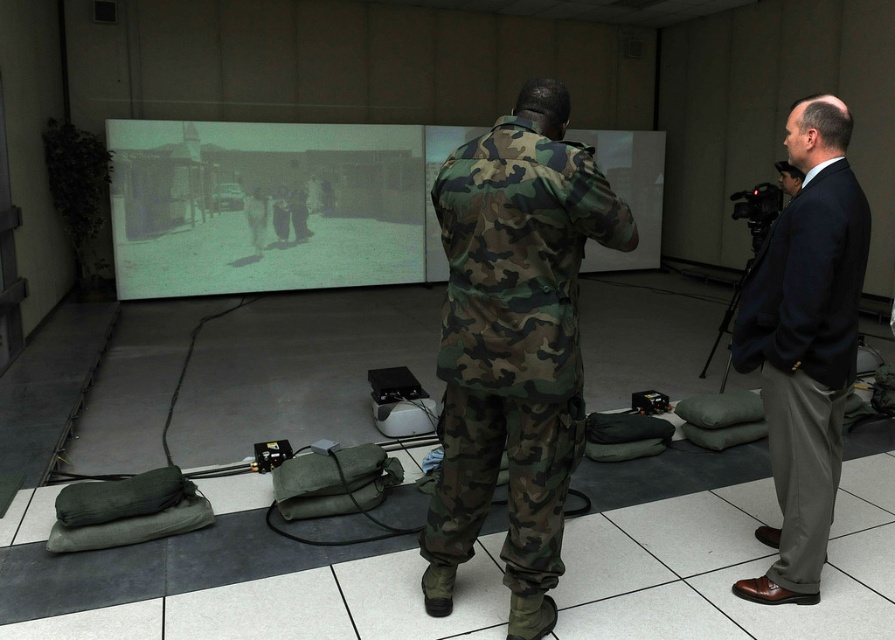
You are a safety officer inspecting the training room. You need to ensure that the gray matte projection screen at center and the dark blue suit at right are positioned safely. Considering their sizes, which object is significantly taller and requires more vertical clearance?

The gray matte projection screen at center is much taller than the dark blue suit at right, so it requires more vertical clearance.

You are a trainee in the room and need to adjust the angle of your firearm to aim at the gray matte projection screen at center. Since the dark blue suit at right is in the way, can you move around it to get a clear shot? Explain your reasoning.

The gray matte projection screen at center is located above the dark blue suit at right. This means the screen is positioned higher than the suit, so you can aim upwards to avoid the obstruction caused by the dark blue suit at right without needing to move around it.

You are a safety officer in the training room. You see the camo fabric uniform at center and the black matte tripod at right. Which object is positioned lower in the image?

The camo fabric uniform at center is located below the black matte tripod at right, so it is positioned lower in the image.